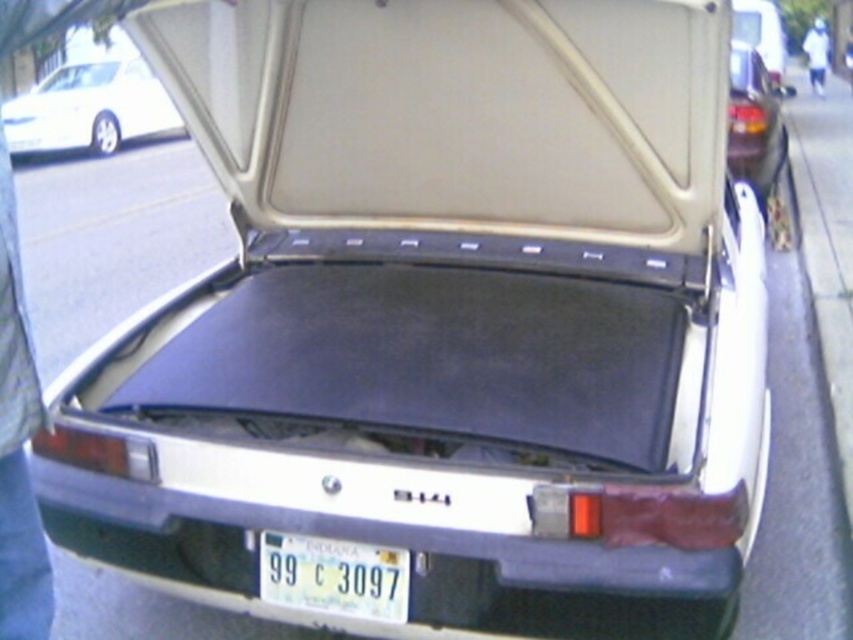
Is white plastic license plate at lower center taller than black matte trunk at upper right?

In fact, white plastic license plate at lower center may be shorter than black matte trunk at upper right.

Measure the distance between point (376, 547) and camera.

A distance of 6.51 feet exists between point (376, 547) and camera.

The width and height of the screenshot is (853, 640). I want to click on white plastic license plate at lower center, so click(334, 577).

Is white matte car at upper left shorter than white plastic license plate at lower center?

No, white matte car at upper left is not shorter than white plastic license plate at lower center.

Does white matte car at upper left come behind white plastic license plate at lower center?

Yes.

Who is more forward, (108, 60) or (380, 588)?

Point (380, 588)

Find the location of a particular element. The width and height of the screenshot is (853, 640). white matte car at upper left is located at coordinates (90, 108).

Who is lower down, white matte car at upper left or black matte trunk at upper right?

black matte trunk at upper right is lower down.

Does white matte car at upper left have a lesser height compared to black matte trunk at upper right?

No, white matte car at upper left is not shorter than black matte trunk at upper right.

Who is more distant from viewer, (154, 113) or (764, 72)?

Positioned behind is point (154, 113).

Where is `white matte car at upper left`? This screenshot has height=640, width=853. white matte car at upper left is located at coordinates (90, 108).